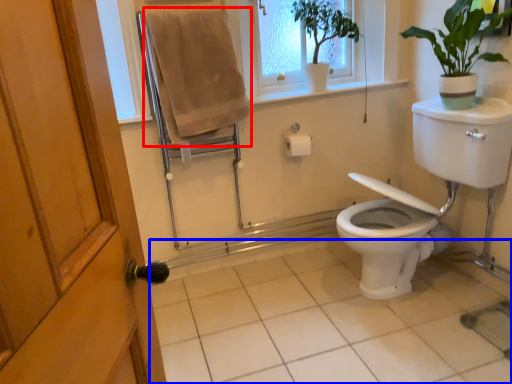
Question: Among these objects, which one is farthest to the camera, bath towel (highlighted by a red box) or tile (highlighted by a blue box)?

Choices:
 (A) bath towel
 (B) tile

Answer: (A)